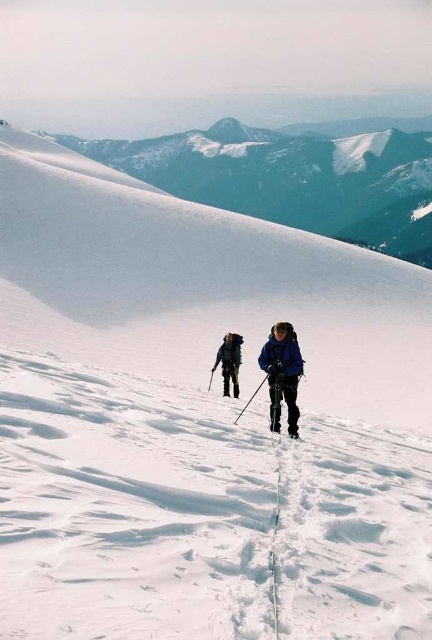
You are a photographer aiming to capture a closeup of the dark blue jacket at center. What are the coordinates where you should focus your camera?

The coordinates to focus on are 0.566 and 0.530.